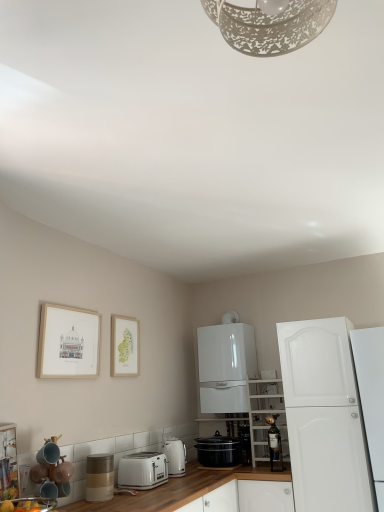
You are a GUI agent. You are given a task and a screenshot of the screen. Output one action in this format:
    pyautogui.click(x=<x>, y=<y>)
    Task: Click on the free space above white plastic toaster at lower center (from a real-world perspective)
    The image size is (384, 512).
    Given the screenshot: What is the action you would take?
    pyautogui.click(x=145, y=456)